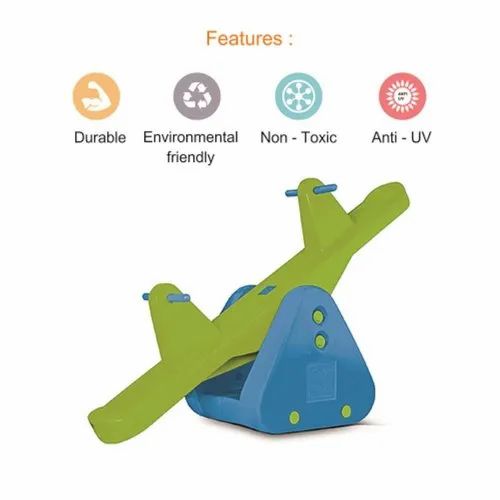
Where is `handle`? handle is located at coordinates (145, 298), (185, 297), (293, 192), (330, 186).